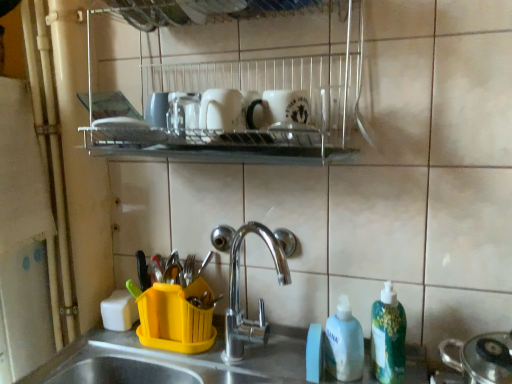
Describe the element at coordinates (245, 89) in the screenshot. I see `metallic wire rack at upper center` at that location.

What do you see at coordinates (190, 357) in the screenshot?
I see `yellow plastic utensil holder at lower center` at bounding box center [190, 357].

Where is `green plastic bottle at lower right, the second cleaning product in the left-to-right sequence`? green plastic bottle at lower right, the second cleaning product in the left-to-right sequence is located at coordinates (388, 337).

The height and width of the screenshot is (384, 512). In order to click on white glossy mug at upper center, which is the 1th mug from left to right in this screenshot , I will do `click(222, 110)`.

Measure the distance between white matte mug at upper center, which ranks as the second mug in left-to-right order, and camera.

30.67 inches.

At what (x,y) coordinates should I click in order to perform the action: click on metallic silver pot at lower right. Please return your answer as a coordinate pair (x, y). Looking at the image, I should click on (462, 314).

How much space does white matte bottle at lower right, arranged as the first cleaning product when viewed from the left, occupy vertically?

17.58 centimeters.

Find the location of a particular element. The image size is (512, 384). metallic wire rack at upper center is located at coordinates (245, 89).

From a real-world perspective, between metallic silver pot at lower right and green plastic bottle at lower right, the second cleaning product in the left-to-right sequence, who is vertically lower?

green plastic bottle at lower right, the second cleaning product in the left-to-right sequence.

Relative to green plastic bottle at lower right, the second cleaning product in the left-to-right sequence, is metallic silver pot at lower right in front or behind?

metallic silver pot at lower right is positioned closer to the viewer than green plastic bottle at lower right, the second cleaning product in the left-to-right sequence.

Does metallic silver pot at lower right have a larger size compared to green plastic bottle at lower right, which ranks as the first cleaning product in right-to-left order?

Yes, metallic silver pot at lower right is bigger than green plastic bottle at lower right, which ranks as the first cleaning product in right-to-left order.

Considering the points (350, 333) and (202, 114), which point is behind, point (350, 333) or point (202, 114)?

The point (350, 333) is more distant.

From a real-world perspective, between white matte bottle at lower right, which is the second cleaning product from right to left, and white glossy mug at upper center, which is the 1th mug from left to right, who is vertically higher?

In real-world perspective, white glossy mug at upper center, which is the 1th mug from left to right, is above.

Does white matte bottle at lower right, arranged as the first cleaning product when viewed from the left, come in front of white glossy mug at upper center, which appears as the 2th mug when viewed from the right?

No, white matte bottle at lower right, arranged as the first cleaning product when viewed from the left, is further to the viewer.

Considering the relative sizes of white matte bottle at lower right, arranged as the first cleaning product when viewed from the left, and white glossy mug at upper center, which is the 1th mug from left to right, in the image provided, is white matte bottle at lower right, arranged as the first cleaning product when viewed from the left, wider than white glossy mug at upper center, which is the 1th mug from left to right,?

No.

How many degrees apart are the facing directions of green plastic bottle at lower right, which ranks as the first cleaning product in right-to-left order, and metallic wire rack at upper center?

The angular difference between green plastic bottle at lower right, which ranks as the first cleaning product in right-to-left order, and metallic wire rack at upper center is 2.15 degrees.

Which object is further away from the camera taking this photo, green plastic bottle at lower right, which ranks as the first cleaning product in right-to-left order, or metallic wire rack at upper center?

green plastic bottle at lower right, which ranks as the first cleaning product in right-to-left order, is further from the camera.

Considering the relative sizes of green plastic bottle at lower right, which ranks as the first cleaning product in right-to-left order, and metallic wire rack at upper center in the image provided, is green plastic bottle at lower right, which ranks as the first cleaning product in right-to-left order, taller than metallic wire rack at upper center?

Incorrect, the height of green plastic bottle at lower right, which ranks as the first cleaning product in right-to-left order, is not larger of that of metallic wire rack at upper center.

Does green plastic bottle at lower right, the second cleaning product in the left-to-right sequence, appear on the left side of metallic wire rack at upper center?

No, green plastic bottle at lower right, the second cleaning product in the left-to-right sequence, is not to the left of metallic wire rack at upper center.

Considering the points (104, 351) and (399, 326), which point is behind, point (104, 351) or point (399, 326)?

The point (104, 351) is behind.

Would you say yellow plastic utensil holder at lower center contains green plastic bottle at lower right, which ranks as the first cleaning product in right-to-left order?

No, green plastic bottle at lower right, which ranks as the first cleaning product in right-to-left order, is not inside yellow plastic utensil holder at lower center.

Considering the relative sizes of yellow plastic utensil holder at lower center and green plastic bottle at lower right, which ranks as the first cleaning product in right-to-left order, in the image provided, is yellow plastic utensil holder at lower center shorter than green plastic bottle at lower right, which ranks as the first cleaning product in right-to-left order,?

In fact, yellow plastic utensil holder at lower center may be taller than green plastic bottle at lower right, which ranks as the first cleaning product in right-to-left order.

Based on the photo, from the image's perspective, which one is positioned lower, yellow plastic utensil holder at lower center or green plastic bottle at lower right, which ranks as the first cleaning product in right-to-left order?

yellow plastic utensil holder at lower center is shown below in the image.

Would you say green plastic bottle at lower right, the second cleaning product in the left-to-right sequence, is a long distance from white matte bottle at lower right, arranged as the first cleaning product when viewed from the left?

No.

How distant is green plastic bottle at lower right, which ranks as the first cleaning product in right-to-left order, from white matte bottle at lower right, arranged as the first cleaning product when viewed from the left?

A distance of 2.65 inches exists between green plastic bottle at lower right, which ranks as the first cleaning product in right-to-left order, and white matte bottle at lower right, arranged as the first cleaning product when viewed from the left.

Which object is wider, green plastic bottle at lower right, which ranks as the first cleaning product in right-to-left order, or white matte bottle at lower right, which is the second cleaning product from right to left?

white matte bottle at lower right, which is the second cleaning product from right to left.

In the scene shown: From their relative heights in the image, would you say green plastic bottle at lower right, which ranks as the first cleaning product in right-to-left order, is taller or shorter than white matte bottle at lower right, which is the second cleaning product from right to left?

green plastic bottle at lower right, which ranks as the first cleaning product in right-to-left order, is taller than white matte bottle at lower right, which is the second cleaning product from right to left.

Considering the relative sizes of metallic wire rack at upper center and white glossy mug at upper center, which appears as the 2th mug when viewed from the right, in the image provided, is metallic wire rack at upper center bigger than white glossy mug at upper center, which appears as the 2th mug when viewed from the right,?

A: Yes, metallic wire rack at upper center is bigger than white glossy mug at upper center, which appears as the 2th mug when viewed from the right.

What's the angular difference between metallic wire rack at upper center and white glossy mug at upper center, which is the 1th mug from left to right,'s facing directions?

There is a 3.41-degree angle between the facing directions of metallic wire rack at upper center and white glossy mug at upper center, which is the 1th mug from left to right.

Is point (294, 75) farther from camera compared to point (209, 128)?

Yes, it is behind point (209, 128).

From the image's perspective, which object appears higher, green plastic bottle at lower right, the second cleaning product in the left-to-right sequence, or yellow plastic utensil holder at lower center?

From the image's view, green plastic bottle at lower right, the second cleaning product in the left-to-right sequence, is above.

Which of these two, green plastic bottle at lower right, which ranks as the first cleaning product in right-to-left order, or yellow plastic utensil holder at lower center, is thinner?

With smaller width is green plastic bottle at lower right, which ranks as the first cleaning product in right-to-left order.

Is yellow plastic utensil holder at lower center a part of green plastic bottle at lower right, the second cleaning product in the left-to-right sequence?

No, yellow plastic utensil holder at lower center is located outside of green plastic bottle at lower right, the second cleaning product in the left-to-right sequence.

Image resolution: width=512 pixels, height=384 pixels. I want to click on the 1st cleaning product positioned below the metallic silver pot at lower right (from a real-world perspective), so click(388, 337).

Find the location of a particular element. The image size is (512, 384). the 2nd mug in front of the white matte bottle at lower right, arranged as the first cleaning product when viewed from the left, starting your count from the anchor is located at coordinates (222, 110).

Considering their positions, is yellow plastic utensil holder at lower center positioned further to metallic wire rack at upper center than white matte bottle at lower right, arranged as the first cleaning product when viewed from the left?

yellow plastic utensil holder at lower center lies further to metallic wire rack at upper center than the other object.

Which object lies further to the anchor point green plastic bottle at lower right, which ranks as the first cleaning product in right-to-left order, white matte mug at upper center, acting as the first mug starting from the right, or white glossy mug at upper center, which is the 1th mug from left to right?

Among the two, white glossy mug at upper center, which is the 1th mug from left to right, is located further to green plastic bottle at lower right, which ranks as the first cleaning product in right-to-left order.

Based on their spatial positions, is yellow plastic utensil holder at lower center or metallic silver pot at lower right further from white matte bottle at lower right, arranged as the first cleaning product when viewed from the left?

Based on the image, yellow plastic utensil holder at lower center appears to be further to white matte bottle at lower right, arranged as the first cleaning product when viewed from the left.

Which object lies nearer to the anchor point white matte bottle at lower right, arranged as the first cleaning product when viewed from the left, green plastic bottle at lower right, the second cleaning product in the left-to-right sequence, or yellow plastic utensil holder at lower center?

The object closer to white matte bottle at lower right, arranged as the first cleaning product when viewed from the left, is green plastic bottle at lower right, the second cleaning product in the left-to-right sequence.

Looking at this image, estimate the real-world distances between objects in this image. Which object is closer to white glossy mug at upper center, which appears as the 2th mug when viewed from the right, green plastic bottle at lower right, which ranks as the first cleaning product in right-to-left order, or yellow plastic utensil holder at lower center?

The object closer to white glossy mug at upper center, which appears as the 2th mug when viewed from the right, is green plastic bottle at lower right, which ranks as the first cleaning product in right-to-left order.

Estimate the real-world distances between objects in this image. Which object is closer to green plastic bottle at lower right, the second cleaning product in the left-to-right sequence, white glossy mug at upper center, which is the 1th mug from left to right, or metallic wire rack at upper center?

white glossy mug at upper center, which is the 1th mug from left to right.

Which object lies further to the anchor point green plastic bottle at lower right, the second cleaning product in the left-to-right sequence, metallic wire rack at upper center or yellow plastic utensil holder at lower center?

metallic wire rack at upper center lies further to green plastic bottle at lower right, the second cleaning product in the left-to-right sequence, than the other object.

Based on their spatial positions, is white matte bottle at lower right, arranged as the first cleaning product when viewed from the left, or metallic wire rack at upper center closer to green plastic bottle at lower right, the second cleaning product in the left-to-right sequence?

white matte bottle at lower right, arranged as the first cleaning product when viewed from the left, lies closer to green plastic bottle at lower right, the second cleaning product in the left-to-right sequence, than the other object.

Identify the location of tile between metallic wire rack at upper center and yellow plastic utensil holder at lower center in the up-down direction. (462, 314).

Locate an element on the screen. cleaning product between metallic wire rack at upper center and white matte bottle at lower right, which is the second cleaning product from right to left, in the vertical direction is located at coordinates (388, 337).

Where is `mug between white glossy mug at upper center, which appears as the 2th mug when viewed from the right, and green plastic bottle at lower right, which ranks as the first cleaning product in right-to-left order, in the vertical direction`? This screenshot has height=384, width=512. mug between white glossy mug at upper center, which appears as the 2th mug when viewed from the right, and green plastic bottle at lower right, which ranks as the first cleaning product in right-to-left order, in the vertical direction is located at coordinates (278, 108).

Where is `cleaning product between white matte mug at upper center, acting as the first mug starting from the right, and white matte bottle at lower right, arranged as the first cleaning product when viewed from the left, in the vertical direction`? cleaning product between white matte mug at upper center, acting as the first mug starting from the right, and white matte bottle at lower right, arranged as the first cleaning product when viewed from the left, in the vertical direction is located at coordinates (388, 337).